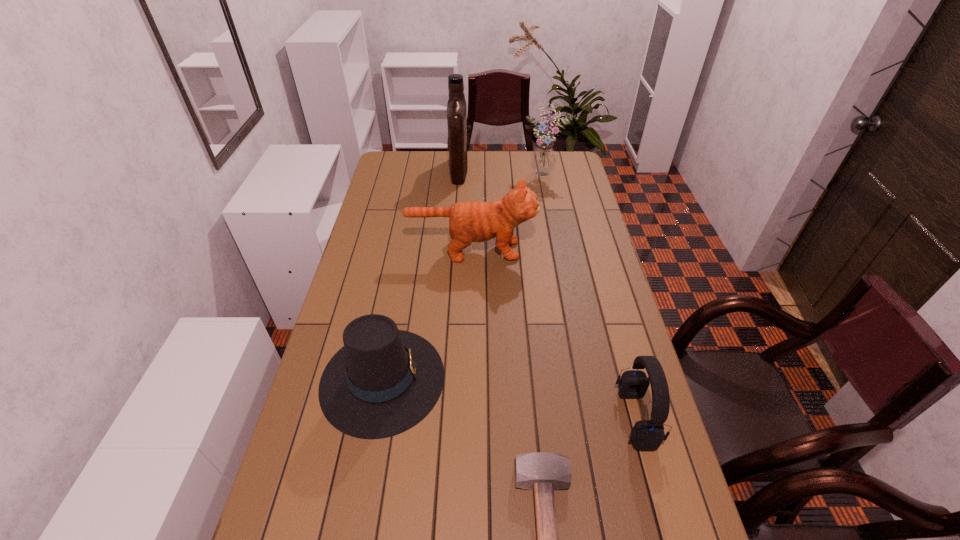
Locate an element on the screen. blank space at the left edge is located at coordinates (374, 279).

You are a GUI agent. You are given a task and a screenshot of the screen. Output one action in this format:
    pyautogui.click(x=<x>, y=<y>)
    Task: Click on the vacant space at the right edge of the desktop
    
    Given the screenshot: What is the action you would take?
    pyautogui.click(x=570, y=239)

Find the location of a particular element. empty space between the tallest object and the hat is located at coordinates (420, 274).

Select which object appears as the fourth closest to the headset. Please provide its 2D coordinates. Your answer should be formatted as a tuple, i.e. [(x, y)], where the tuple contains the x and y coordinates of a point satisfying the conditions above.

[(543, 161)]

Identify which object is the fourth nearest to the hat. Please provide its 2D coordinates. Your answer should be formatted as a tuple, i.e. [(x, y)], where the tuple contains the x and y coordinates of a point satisfying the conditions above.

[(456, 106)]

The height and width of the screenshot is (540, 960). What are the coordinates of `vacant position in the image that satisfies the following two spatial constraints: 1. on the front-facing side of the bouquet; 2. on the front-facing side of the hat` in the screenshot? It's located at (588, 379).

Where is `free space that satisfies the following two spatial constraints: 1. on the front-facing side of the bouquet; 2. on the front-facing side of the hat`? The height and width of the screenshot is (540, 960). free space that satisfies the following two spatial constraints: 1. on the front-facing side of the bouquet; 2. on the front-facing side of the hat is located at coordinates (588, 379).